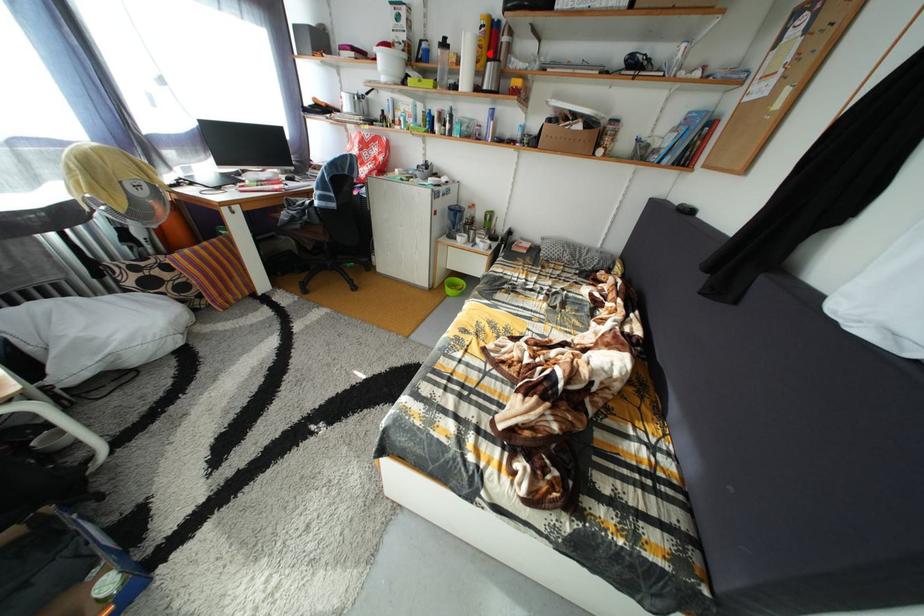
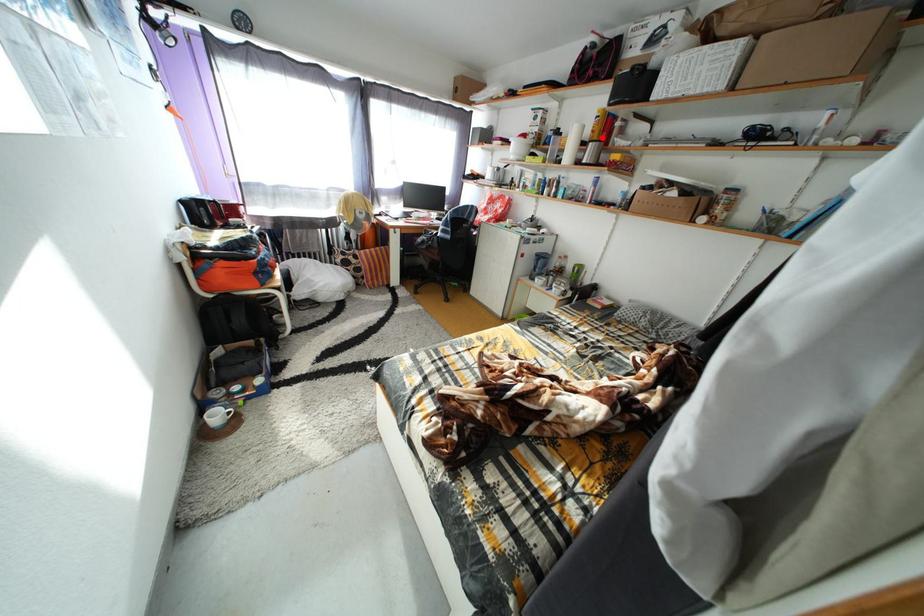
I am providing you with two images of the same scene from different viewpoints. A red point is marked on the first image and another point is marked on the second image. Does the point marked in image1 correspond to the same location as the one in image2?

Yes